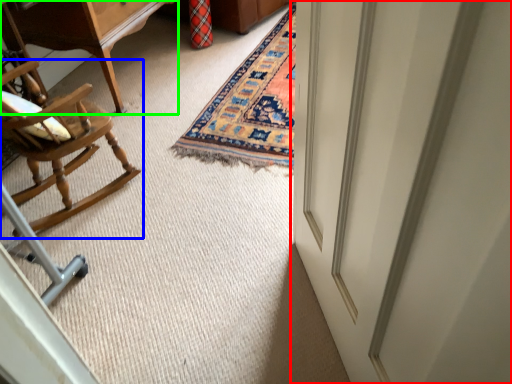
Question: Considering the real-world distances, which object is farthest from door (highlighted by a red box)? chair (highlighted by a blue box) or table (highlighted by a green box)?

Choices:
 (A) chair
 (B) table

Answer: (B)